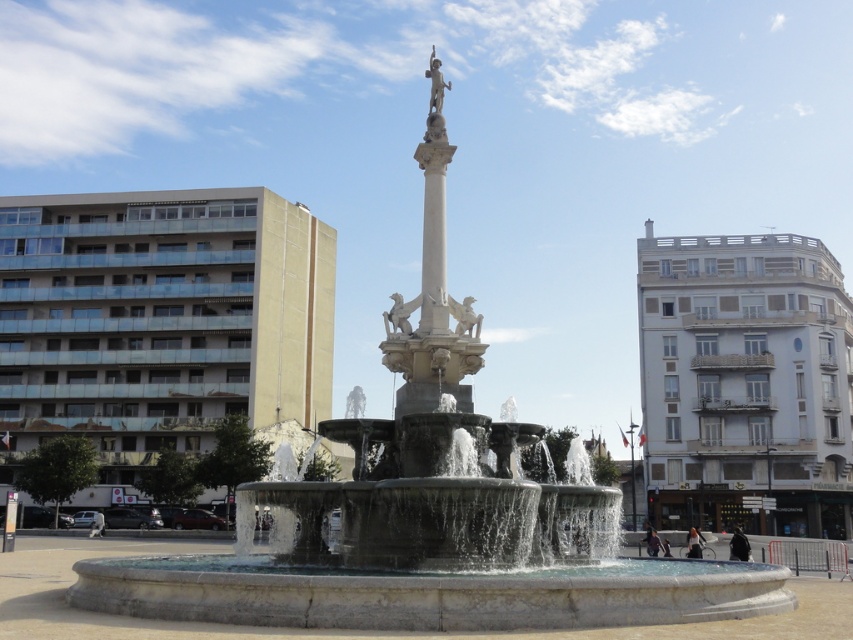
You are standing at the camera position and want to take a photo of the grand fountain. The beige concrete building at left is blocking part of your view. Can you estimate whether the building is close enough to require moving further back to capture the entire fountain in one shot?

The beige concrete building at left is 104.86 meters from the camera. Since the building is quite far away, you might not need to move back significantly to capture the entire fountain in your photo. However, precise adjustments depend on your camera lens and desired framing.

You are standing in the public square and want to take a photo of both the beige concrete building at left and the white marble column at center. Which object should you position closer to the camera to ensure both are fully visible in the frame?

You should position the beige concrete building at left closer to the camera because it is taller than the white marble column at center, allowing both to fit within the frame without cropping either.

You are standing in the public square looking at the grand fountain. There are two points marked in the image. The first point is at coordinates point [227,236] and the second is at point [425,324]. From your perspective, which point is closer to you?

Point [425,324] is closer to you because the description states that point [227,236] is behind point [425,324].